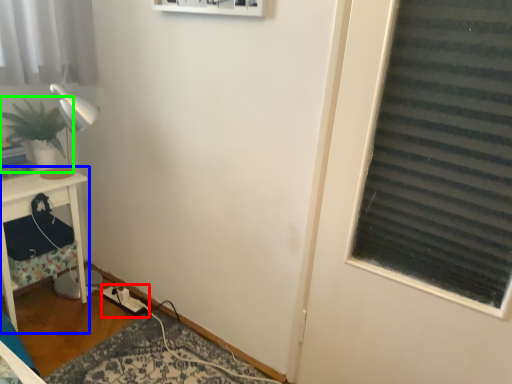
Question: Based on their relative distances, which object is nearer to extension cord (highlighted by a red box)? Choose from furniture (highlighted by a blue box) and houseplant (highlighted by a green box).

Choices:
 (A) furniture
 (B) houseplant

Answer: (A)